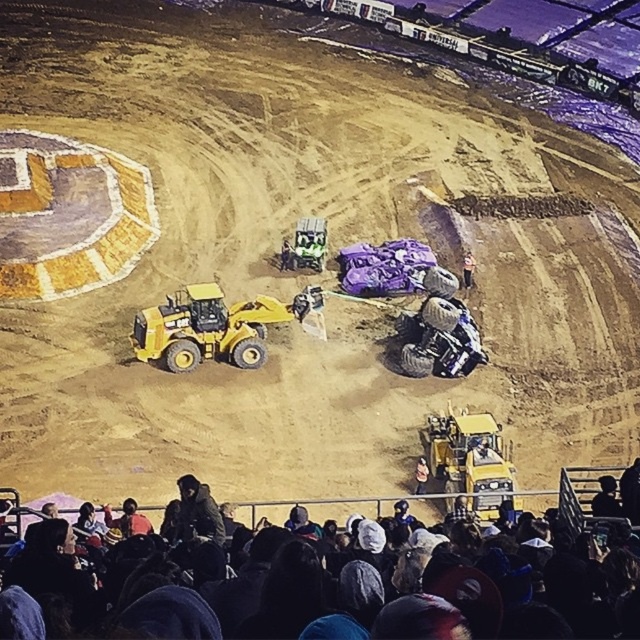
Question: Among these points, which one is nearest to the camera?

Choices:
 (A) (252, 634)
 (B) (426, 468)
 (C) (442, 476)

Answer: (A)

Question: Is dark clothing crowd at lower center wider than light brown leather jacket at center?

Choices:
 (A) no
 (B) yes

Answer: (B)

Question: Can you confirm if dark clothing crowd at lower center is positioned to the right of light brown leather jacket at center?

Choices:
 (A) yes
 (B) no

Answer: (B)

Question: Which object appears farthest from the camera in this image?

Choices:
 (A) dark clothing crowd at lower center
 (B) light brown leather jacket at lower center
 (C) yellow rubber monster truck at lower right
 (D) light brown leather jacket at center

Answer: (D)

Question: Among these points, which one is nearest to the camera?

Choices:
 (A) (465, 278)
 (B) (593, 628)
 (C) (419, 490)
 (D) (216, 508)

Answer: (B)

Question: Is dark gray jacket at lower left above light brown leather jacket at center?

Choices:
 (A) yes
 (B) no

Answer: (B)